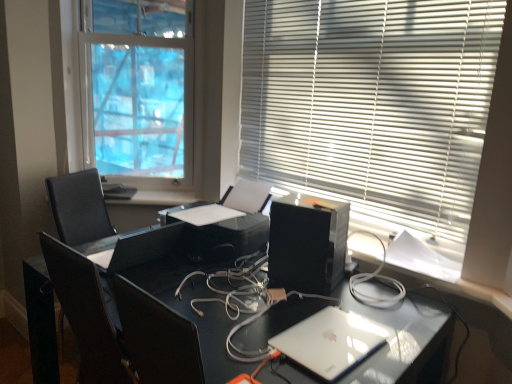
Where is `vacant space underneath satin white laptop at lower right (from a real-world perspective)`? vacant space underneath satin white laptop at lower right (from a real-world perspective) is located at coordinates (337, 335).